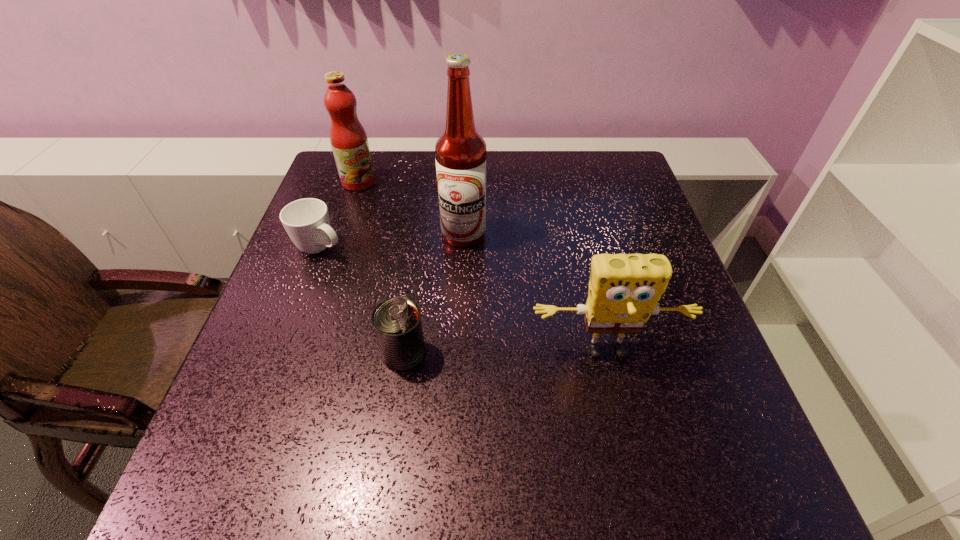
Find the location of a particular element. This screenshot has width=960, height=540. object positioned at the far edge is located at coordinates (349, 142).

Where is `cup that is at the left edge`? cup that is at the left edge is located at coordinates (307, 222).

The height and width of the screenshot is (540, 960). What are the coordinates of `fruit juice located in the left edge section of the desktop` in the screenshot? It's located at (349, 142).

Locate an element on the screen. object located at the right edge is located at coordinates (624, 289).

At what (x,y) coordinates should I click in order to perform the action: click on object at the far left corner. Please return your answer as a coordinate pair (x, y). Looking at the image, I should click on [349, 142].

Identify the location of vacant space at the far edge. The width and height of the screenshot is (960, 540). (384, 170).

In the image, there is a desktop. At what (x,y) coordinates should I click in order to perform the action: click on vacant space at the near edge. Please return your answer as a coordinate pair (x, y). Looking at the image, I should click on (411, 429).

What are the coordinates of `vacant area at the left edge of the desktop` in the screenshot? It's located at (348, 211).

At what (x,y) coordinates should I click in order to perform the action: click on vacant space at the right edge of the desktop. Please return your answer as a coordinate pair (x, y). Image resolution: width=960 pixels, height=540 pixels. Looking at the image, I should click on (651, 349).

You are a GUI agent. You are given a task and a screenshot of the screen. Output one action in this format:
    pyautogui.click(x=<x>, y=<y>)
    Task: Click on the vacant space at the far left corner
    
    Given the screenshot: What is the action you would take?
    (x=323, y=191)